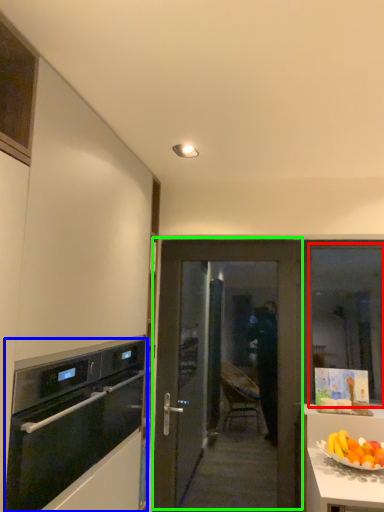
Question: Based on their relative distances, which object is nearer to window (highlighted by a red box)? Choose from kitchen appliance (highlighted by a blue box) and door (highlighted by a green box).

Choices:
 (A) kitchen appliance
 (B) door

Answer: (B)